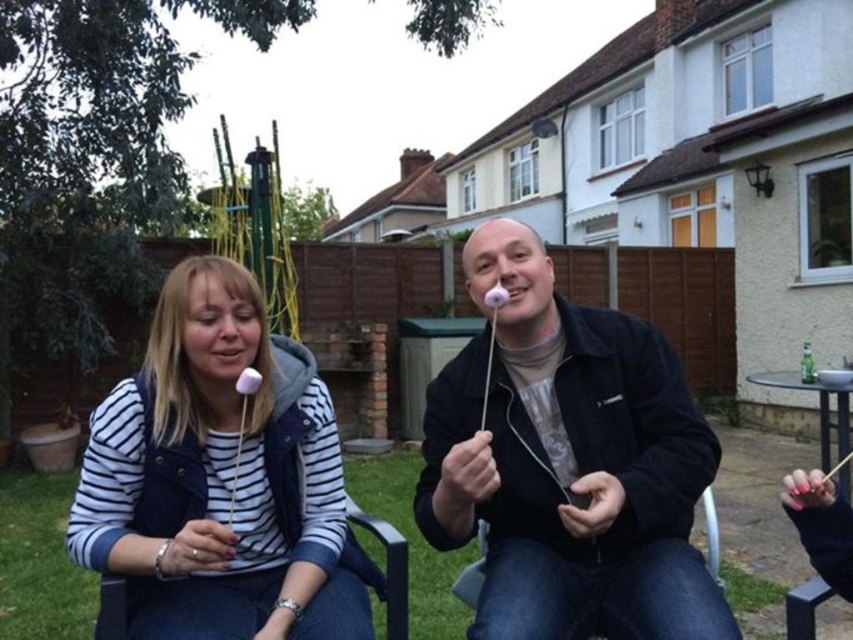
Question: Can you confirm if white marshmallow at center is thinner than white striped shirt at center?

Choices:
 (A) yes
 (B) no

Answer: (B)

Question: Considering the real-world distances, which object is closest to the white striped shirt at center?

Choices:
 (A) white matte marshmallow at center
 (B) white marshmallow at center

Answer: (B)

Question: Does white marshmallow at center have a greater width compared to white striped shirt at center?

Choices:
 (A) yes
 (B) no

Answer: (A)

Question: Which is farther from the white matte marshmallow at center?

Choices:
 (A) white striped shirt at center
 (B) white marshmallow at center

Answer: (A)

Question: From the image, what is the correct spatial relationship of white matte marshmallow at center in relation to white striped shirt at center?

Choices:
 (A) right
 (B) left

Answer: (A)

Question: Which point is farther from the camera taking this photo?

Choices:
 (A) (207, 416)
 (B) (479, 278)
 (C) (444, 524)

Answer: (A)